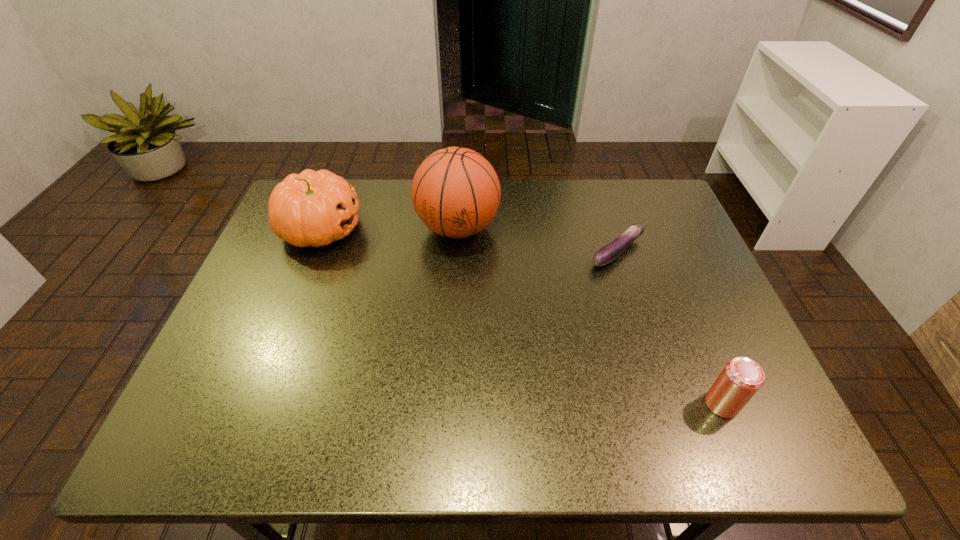
Locate an element on the screen. The image size is (960, 540). free space that satisfies the following two spatial constraints: 1. on the carved face of the pumpkin; 2. on the left side of the eggplant is located at coordinates (312, 252).

At what (x,y) coordinates should I click in order to perform the action: click on vacant space that satisfies the following two spatial constraints: 1. on the front side of the basketball; 2. on the left side of the nearest object. Please return your answer as a coordinate pair (x, y). This screenshot has width=960, height=540. Looking at the image, I should click on (448, 403).

Find the location of a particular element. vacant space that satisfies the following two spatial constraints: 1. on the back side of the shortest object; 2. on the carved face of the pumpkin is located at coordinates (611, 228).

The width and height of the screenshot is (960, 540). I want to click on blank area in the image that satisfies the following two spatial constraints: 1. on the carved face of the leftmost object; 2. on the left side of the eggplant, so click(x=312, y=252).

This screenshot has height=540, width=960. In order to click on vacant space that satisfies the following two spatial constraints: 1. on the front side of the eggplant; 2. on the left side of the basketball in this screenshot , I will do `click(456, 252)`.

This screenshot has width=960, height=540. In order to click on blank space that satisfies the following two spatial constraints: 1. on the carved face of the leftmost object; 2. on the back side of the eggplant in this screenshot , I will do `click(312, 252)`.